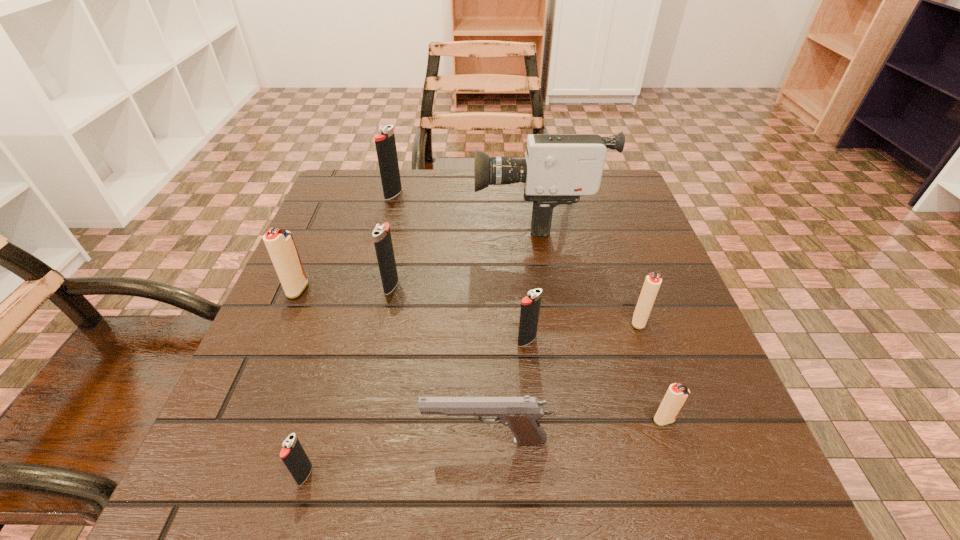
Identify the location of empty space that is in between the third nearest object and the nearest black igniter. This screenshot has height=540, width=960. (485, 447).

The width and height of the screenshot is (960, 540). In order to click on free space between the second biggest black igniter and the pistol in this screenshot , I will do `click(439, 363)`.

Locate an element on the screen. The image size is (960, 540). unoccupied position between the smallest black igniter and the pistol is located at coordinates (396, 457).

Locate an element on the screen. The width and height of the screenshot is (960, 540). object identified as the third closest to the camcorder is located at coordinates tap(652, 282).

At what (x,y) coordinates should I click in order to perform the action: click on object that ranks as the fifth closest to the rightmost black igniter. Please return your answer as a coordinate pair (x, y). Image resolution: width=960 pixels, height=540 pixels. Looking at the image, I should click on (559, 168).

Select which igniter appears as the fifth closest to the seventh farthest object. Please provide its 2D coordinates. Your answer should be formatted as a tuple, i.e. [(x, y)], where the tuple contains the x and y coordinates of a point satisfying the conditions above.

[(280, 244)]

Where is `igniter that is the fifth closest to the fifth nearest object`? The image size is (960, 540). igniter that is the fifth closest to the fifth nearest object is located at coordinates (385, 143).

In order to click on the closest black igniter to the pistol in this screenshot , I will do `click(293, 455)`.

Identify which black igniter is the nearest to the biggest red igniter. Please provide its 2D coordinates. Your answer should be formatted as a tuple, i.e. [(x, y)], where the tuple contains the x and y coordinates of a point satisfying the conditions above.

[(382, 239)]

Locate an element on the screen. Image resolution: width=960 pixels, height=540 pixels. red igniter identified as the second closest to the fourth igniter from right to left is located at coordinates (652, 282).